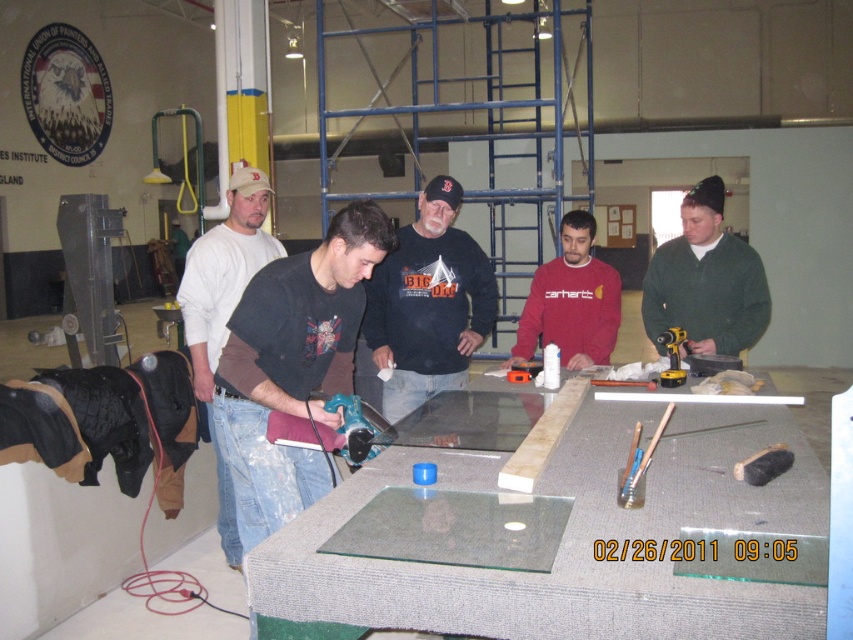
Question: Considering the real-world distances, which object is farthest from the blue plastic drill at center?

Choices:
 (A) red cotton shirt at center
 (B) white cotton shirt at center

Answer: (B)

Question: Can you confirm if green fuzzy beanie at center is wider than white cotton shirt at center?

Choices:
 (A) yes
 (B) no

Answer: (B)

Question: Is black cotton sweatshirt at center further to camera compared to green fuzzy beanie at center?

Choices:
 (A) no
 (B) yes

Answer: (B)

Question: Based on their relative distances, which object is farther from the white cotton shirt at center?

Choices:
 (A) black cotton sweatshirt at center
 (B) green fuzzy beanie at center

Answer: (B)

Question: Is clear glass table at center to the right of red cotton shirt at center from the viewer's perspective?

Choices:
 (A) no
 (B) yes

Answer: (A)

Question: Which object appears closest to the camera in this image?

Choices:
 (A) black cotton sweatshirt at center
 (B) clear glass table at center
 (C) white cotton shirt at center
 (D) green fuzzy beanie at center

Answer: (B)